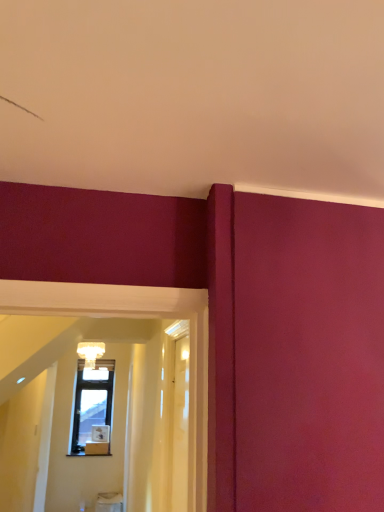
Question: From the image's perspective, relative to matte glass chandelier at upper center, is transparent glass door at center, marked as the second glass door in a left-to-right arrangement, above or below?

Choices:
 (A) above
 (B) below

Answer: (A)

Question: Considering the positions of point (180, 371) and point (77, 350), is point (180, 371) closer or farther from the camera than point (77, 350)?

Choices:
 (A) farther
 (B) closer

Answer: (B)

Question: Which is farther from the transparent glass door at center, marked as the 1th glass door in a right-to-left arrangement?

Choices:
 (A) transparent wood door at center, acting as the first glass door starting from the left
 (B) matte glass chandelier at upper center

Answer: (B)

Question: Which is nearer to the transparent wood door at center, acting as the first glass door starting from the left?

Choices:
 (A) matte glass chandelier at upper center
 (B) transparent glass door at center, marked as the second glass door in a left-to-right arrangement

Answer: (B)